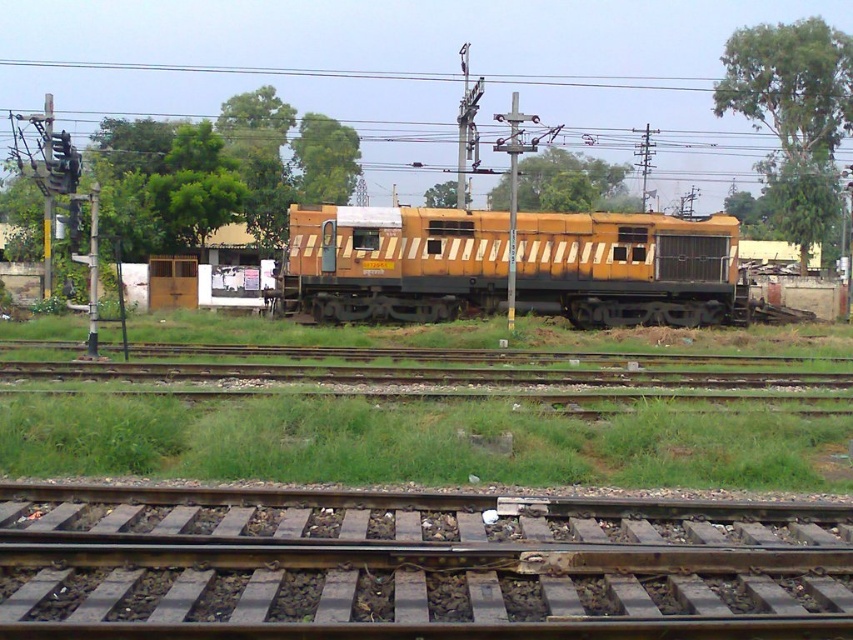
Between brown gravel train track at center and green grass at lower center, which one has more height?

With more height is green grass at lower center.

Does brown gravel train track at center have a larger size compared to green grass at lower center?

Actually, brown gravel train track at center might be smaller than green grass at lower center.

The width and height of the screenshot is (853, 640). Find the location of `brown gravel train track at center`. brown gravel train track at center is located at coordinates (415, 564).

Who is shorter, brown gravel train track at center or yellow matte locomotive at center?

brown gravel train track at center is shorter.

Which is more to the right, brown gravel train track at center or yellow matte locomotive at center?

Positioned to the right is yellow matte locomotive at center.

Is point (367, 628) positioned behind point (341, 278)?

No, it is not.

Where is `brown gravel train track at center`? This screenshot has width=853, height=640. brown gravel train track at center is located at coordinates (415, 564).

Does green grass at lower center have a larger size compared to yellow matte locomotive at center?

No.

Looking at this image, does green grass at lower center appear on the right side of yellow matte locomotive at center?

In fact, green grass at lower center is to the left of yellow matte locomotive at center.

Find the location of a particular element. This screenshot has height=640, width=853. green grass at lower center is located at coordinates (415, 442).